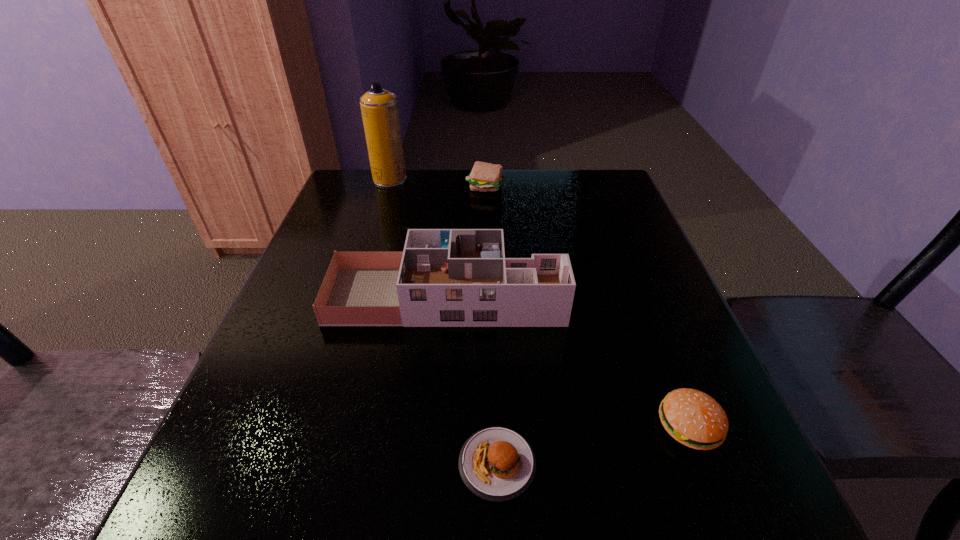
Image resolution: width=960 pixels, height=540 pixels. I want to click on vacant region located 0.320m on the left of the rightmost object, so click(x=456, y=426).

At what (x,y) coordinates should I click in order to perform the action: click on vacant space located 0.320m on the left of the shortest food. Please return your answer as a coordinate pair (x, y). Looking at the image, I should click on (242, 464).

Locate an element on the screen. The width and height of the screenshot is (960, 540). aerosol can that is positioned at the far edge is located at coordinates (379, 108).

Find the location of a particular element. The height and width of the screenshot is (540, 960). patty present at the far edge is located at coordinates (485, 177).

Where is `object located at the near edge`? Image resolution: width=960 pixels, height=540 pixels. object located at the near edge is located at coordinates (498, 464).

Locate an element on the screen. This screenshot has height=540, width=960. aerosol can that is at the left edge is located at coordinates (379, 108).

This screenshot has width=960, height=540. I want to click on dollhouse that is at the left edge, so click(444, 277).

Locate an element on the screen. object present at the right edge is located at coordinates (693, 418).

Where is `object present at the far left corner`? object present at the far left corner is located at coordinates (379, 108).

This screenshot has width=960, height=540. I want to click on free space at the far edge of the desktop, so click(444, 187).